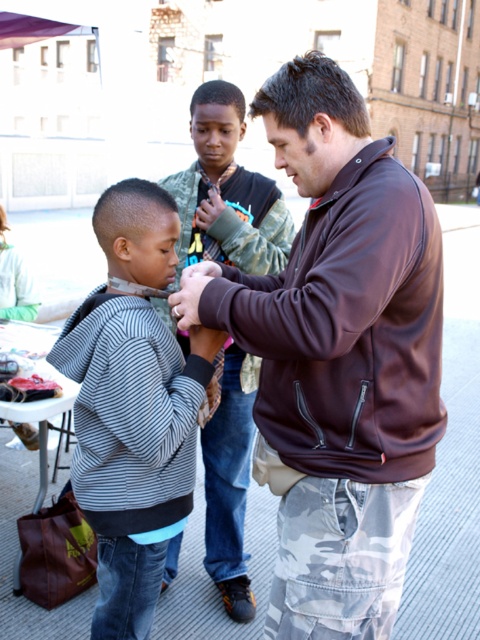
Question: Can you confirm if striped cotton hoodie at center is positioned to the left of striped fabric shirt at center?

Choices:
 (A) no
 (B) yes

Answer: (B)

Question: Among these points, which one is farthest from the camera?

Choices:
 (A) (101, 472)
 (B) (237, 144)
 (C) (434, 216)

Answer: (B)

Question: Does brown soft jacket at center appear on the right side of striped fabric shirt at center?

Choices:
 (A) yes
 (B) no

Answer: (A)

Question: Among these objects, which one is nearest to the camera?

Choices:
 (A) striped cotton sweatshirt at center
 (B) striped cotton hoodie at center

Answer: (A)

Question: Is striped cotton hoodie at center below striped fabric shirt at center?

Choices:
 (A) no
 (B) yes

Answer: (B)

Question: Which object is farther from the camera taking this photo?

Choices:
 (A) striped fabric shirt at center
 (B) striped cotton sweatshirt at center
 (C) striped cotton hoodie at center

Answer: (A)